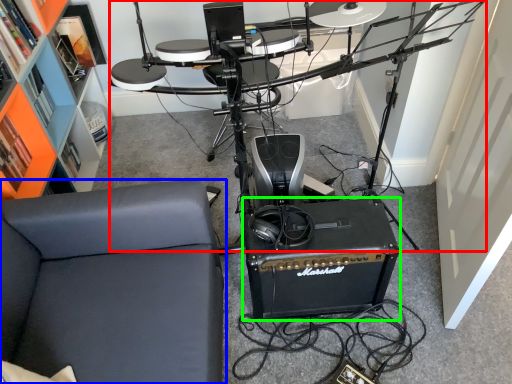
Question: Which is farther away from computer desk (highlighted by a red box)? furniture (highlighted by a blue box) or speaker (highlighted by a green box)?

Choices:
 (A) furniture
 (B) speaker

Answer: (A)